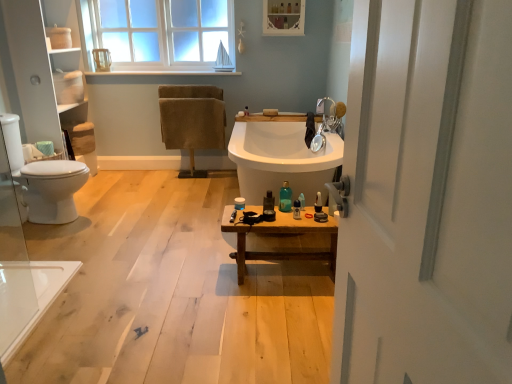
You are a GUI agent. You are given a task and a screenshot of the screen. Output one action in this format:
    pyautogui.click(x=<x>, y=<y>)
    Task: Click on the free region on the left part of wooden bench at center
    Image resolution: width=512 pixels, height=384 pixels.
    Given the screenshot: What is the action you would take?
    pyautogui.click(x=196, y=274)